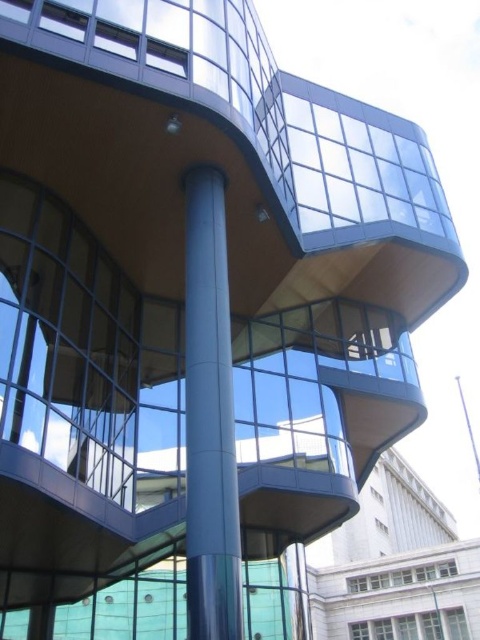
You are an architect reviewing the design of the modern building. You notice two central support structures labeled as the satin silver column at center and the blue metallic pole at center. According to the design specifications, which one is positioned to the left when viewed from the front?

The satin silver column at center is positioned to the left of the blue metallic pole at center when viewed from the front.

You are standing in front of the modern architectural structure and want to take a photo. You notice two points marked on the building. Which point, the point at coordinates (192, 307) or the point at (464, 416), is closer to your camera?

The point at coordinates (192, 307) is closer to the camera than the point at (464, 416).

You are an architect analyzing the structural design of the building. You observe the satin silver column at center and the blue metallic pole at center. Which object is positioned higher in the image?

The satin silver column at center is positioned higher than the blue metallic pole at center.